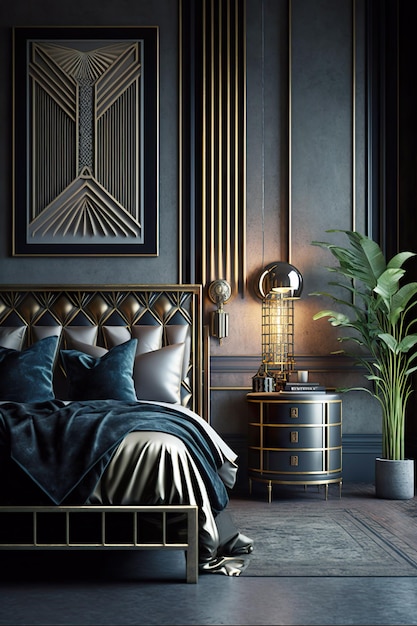
The width and height of the screenshot is (417, 626). I want to click on rug, so click(x=318, y=526), click(x=397, y=514).